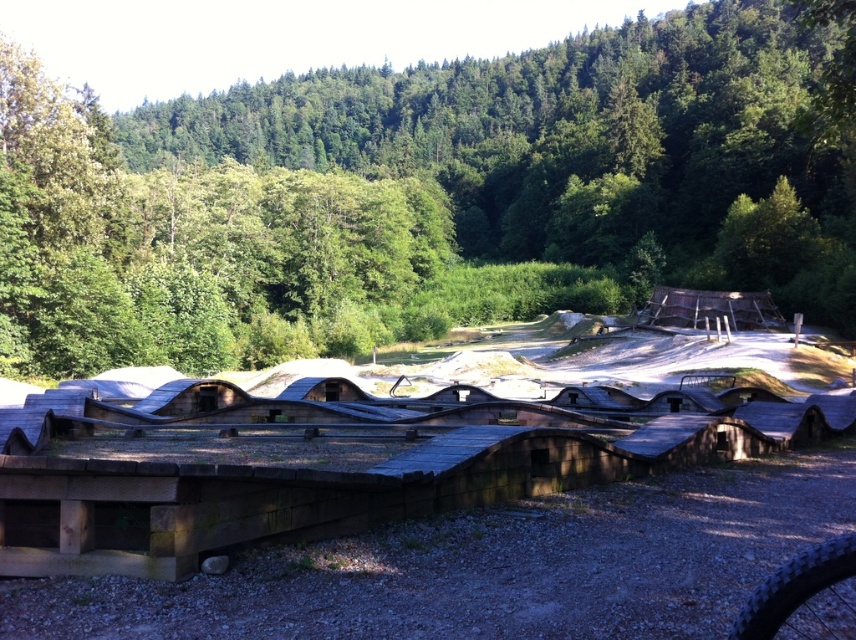
Question: Does green leafy forest at upper center appear under black rubber tire at lower right?

Choices:
 (A) no
 (B) yes

Answer: (A)

Question: Which object is farther from the camera taking this photo?

Choices:
 (A) green leafy forest at upper center
 (B) black rubber tire at lower right

Answer: (A)

Question: Can you confirm if green leafy forest at upper center is bigger than black rubber tire at lower right?

Choices:
 (A) yes
 (B) no

Answer: (A)

Question: Is green leafy forest at upper center below black rubber tire at lower right?

Choices:
 (A) yes
 (B) no

Answer: (B)

Question: Which point is closer to the camera taking this photo?

Choices:
 (A) (586, 36)
 (B) (833, 618)

Answer: (B)